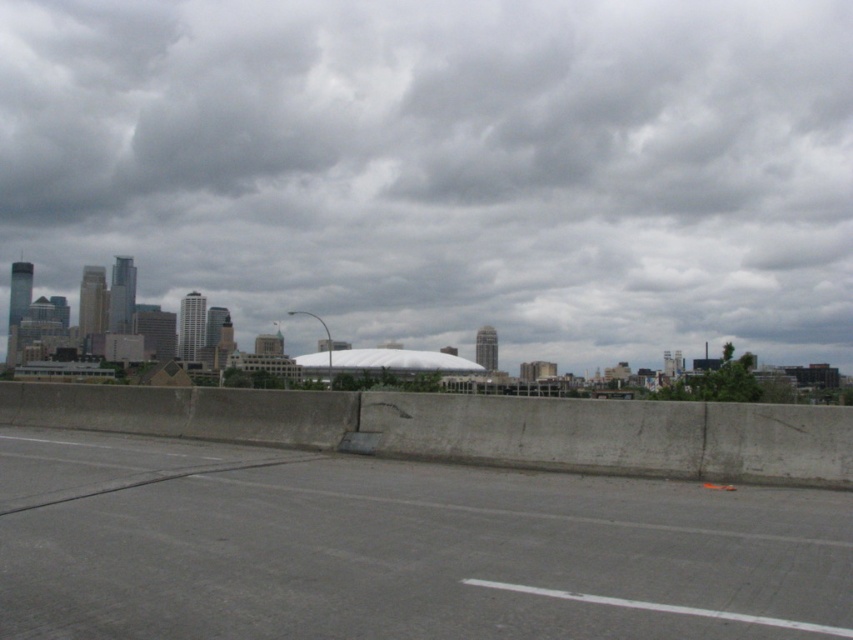
Between gray cloudy sky at upper center and gray concrete highway at lower center, which one appears on the left side from the viewer's perspective?

From the viewer's perspective, gray concrete highway at lower center appears more on the left side.

Who is more distant from viewer, [416,200] or [834,563]?

Positioned behind is point [416,200].

The width and height of the screenshot is (853, 640). Find the location of `gray cloudy sky at upper center`. gray cloudy sky at upper center is located at coordinates (445, 168).